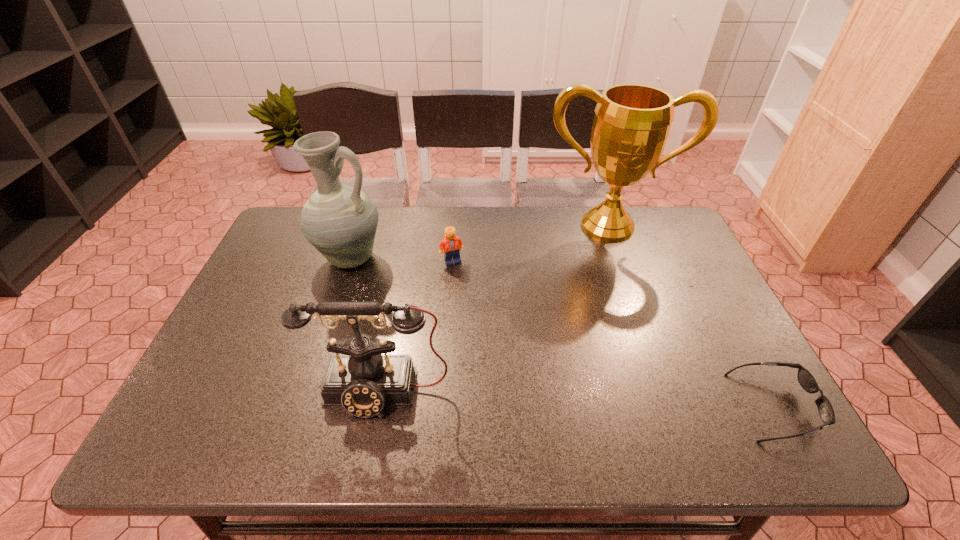
Identify the location of empty space that is in between the third shortest object and the sunglasses. The image size is (960, 540). (577, 400).

The width and height of the screenshot is (960, 540). I want to click on vacant region between the fourth tallest object and the award, so click(530, 244).

Find the location of `empty space between the sunglasses and the third shortest object`. empty space between the sunglasses and the third shortest object is located at coordinates pos(577,400).

The height and width of the screenshot is (540, 960). In order to click on free spot between the second tallest object and the sunglasses in this screenshot , I will do `click(562, 332)`.

The width and height of the screenshot is (960, 540). In order to click on free space between the telephone and the fourth shortest object in this screenshot , I will do `click(365, 326)`.

This screenshot has width=960, height=540. I want to click on free spot between the shortest object and the award, so tap(690, 316).

Where is `vacant area between the pitcher and the award`? Image resolution: width=960 pixels, height=540 pixels. vacant area between the pitcher and the award is located at coordinates (479, 242).

Locate an element on the screen. This screenshot has height=540, width=960. empty space between the sunglasses and the third shortest object is located at coordinates (577, 400).

What are the coordinates of `unoccupied position between the award and the fourth shortest object` in the screenshot? It's located at (479, 242).

Where is `object that is the third closest to the sunglasses`? The width and height of the screenshot is (960, 540). object that is the third closest to the sunglasses is located at coordinates (451, 244).